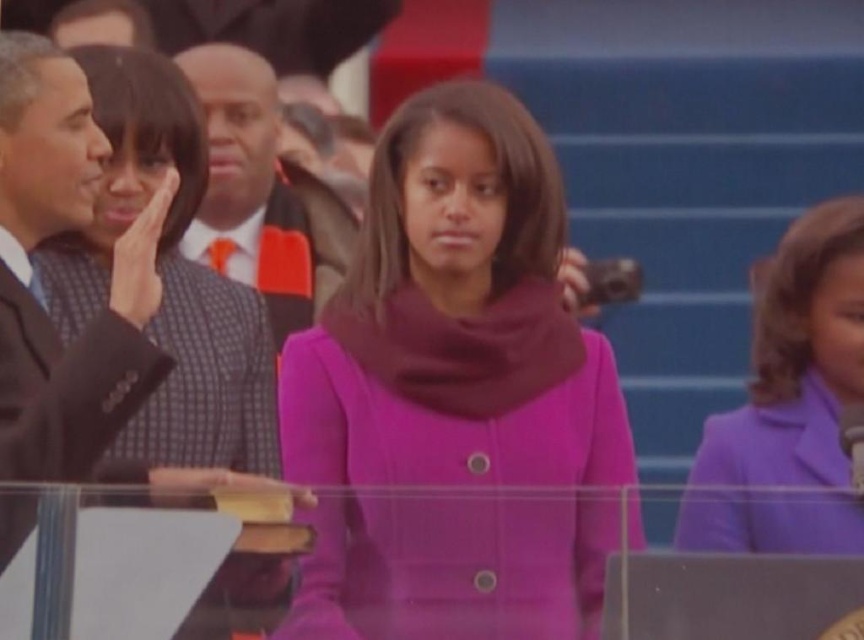
Which is more to the right, matte black suit at left or orange textured tie at center?

matte black suit at left is more to the right.

Is matte black suit at left behind orange textured tie at center?

No, it is not.

Where is `matte black suit at left`? The height and width of the screenshot is (640, 864). matte black suit at left is located at coordinates (168, 278).

Does matte purple coat at center have a larger size compared to dark suit at left?

Correct, matte purple coat at center is larger in size than dark suit at left.

Which is more to the left, matte purple coat at center or dark suit at left?

dark suit at left is more to the left.

Who is more forward, (405, 113) or (68, 189)?

Point (68, 189) is more forward.

Where is `matte purple coat at center`? The width and height of the screenshot is (864, 640). matte purple coat at center is located at coordinates (455, 321).

Does matte purple coat at center come behind orange textured tie at center?

No, matte purple coat at center is in front of orange textured tie at center.

Which is behind, point (494, 221) or point (233, 84)?

Point (233, 84)

Locate an element on the screen. matte purple coat at center is located at coordinates click(x=455, y=321).

The width and height of the screenshot is (864, 640). I want to click on matte purple coat at center, so click(455, 321).